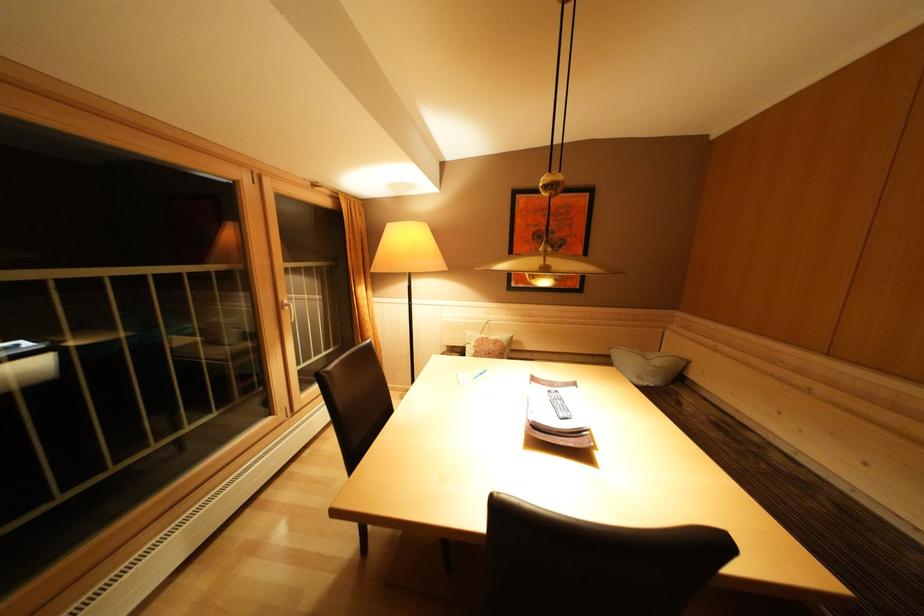
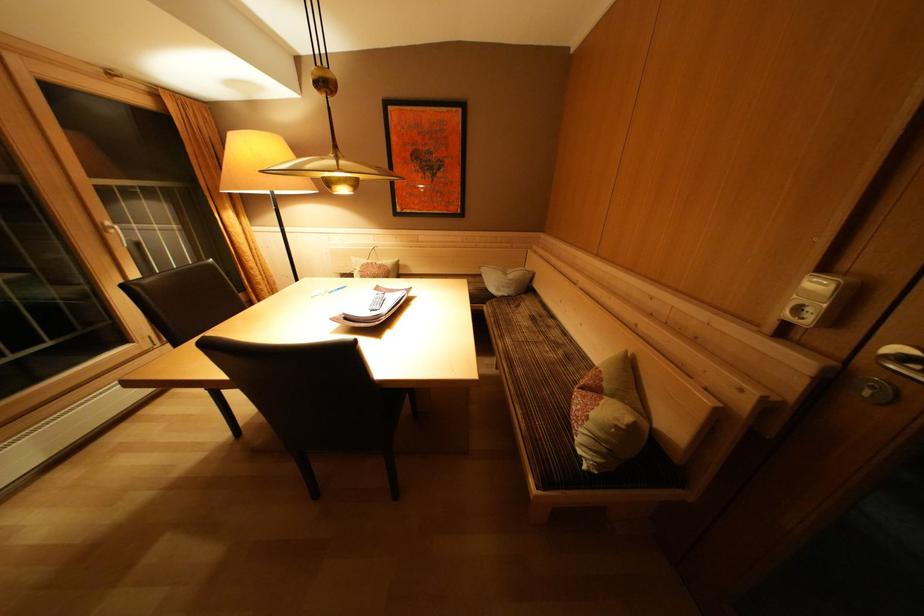
Locate, in the second image, the point that corresponds to (764,451) in the first image.

(555, 331)